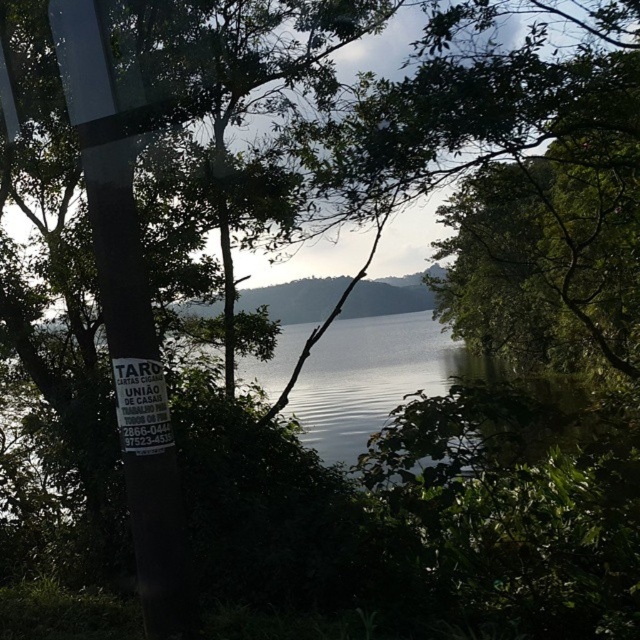
Who is more forward, (104, 292) or (161, 444)?

Point (161, 444) is more forward.

Locate an element on the screen. black plastic pole at left is located at coordinates (125, 321).